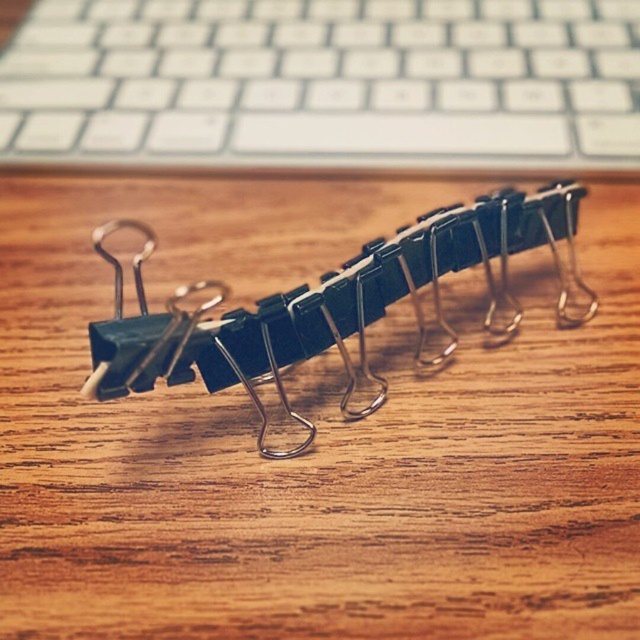
Question: Among these points, which one is farthest from the camera?

Choices:
 (A) pos(468,3)
 (B) pos(417,259)

Answer: (A)

Question: Which point is closer to the camera?

Choices:
 (A) (84, 44)
 (B) (200, 371)

Answer: (B)

Question: Is white plastic keyboard at upper center thinner than metallic silver binder clip at center?

Choices:
 (A) yes
 (B) no

Answer: (B)

Question: Which point is farther to the camera?

Choices:
 (A) white plastic keyboard at upper center
 (B) metallic silver binder clip at center

Answer: (A)

Question: Considering the relative positions of white plastic keyboard at upper center and metallic silver binder clip at center in the image provided, where is white plastic keyboard at upper center located with respect to metallic silver binder clip at center?

Choices:
 (A) left
 (B) right

Answer: (A)

Question: Does white plastic keyboard at upper center appear on the left side of metallic silver binder clip at center?

Choices:
 (A) no
 (B) yes

Answer: (B)